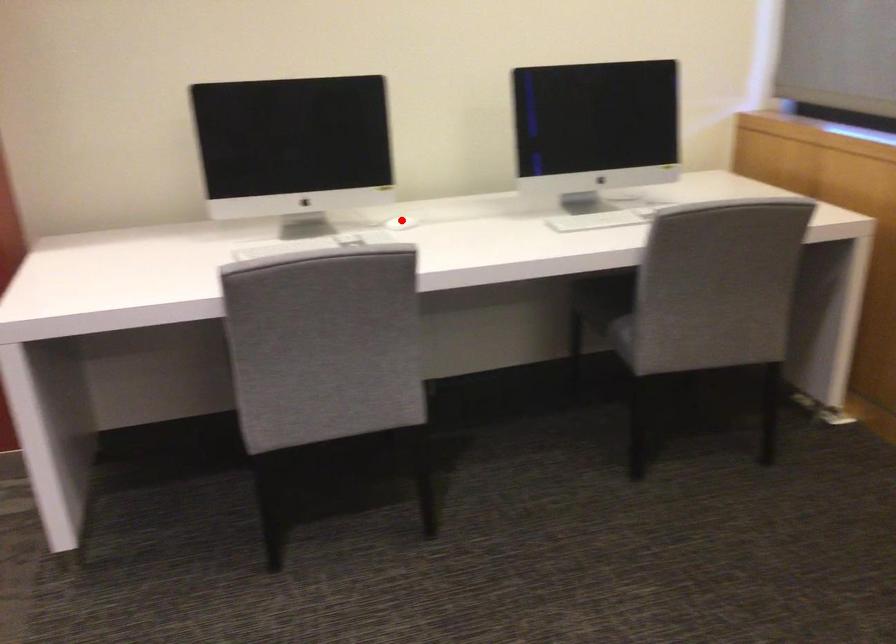
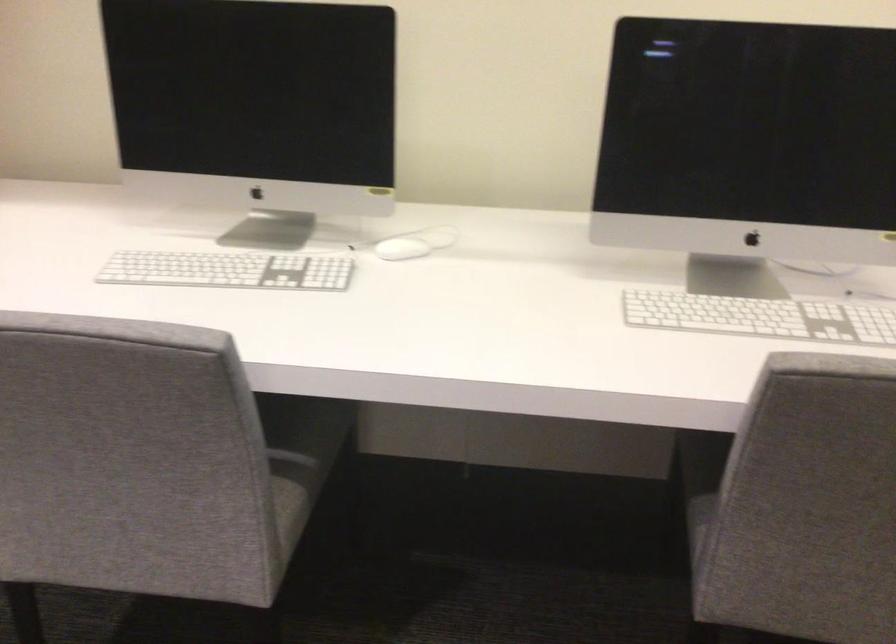
Question: A red point is marked in image1. In image2, is the corresponding 3D point closer to the camera or farther? Reply with the corresponding letter.

Choices:
 (A) The corresponding 3D point is closer.
 (B) The corresponding 3D point is farther.

Answer: (A)